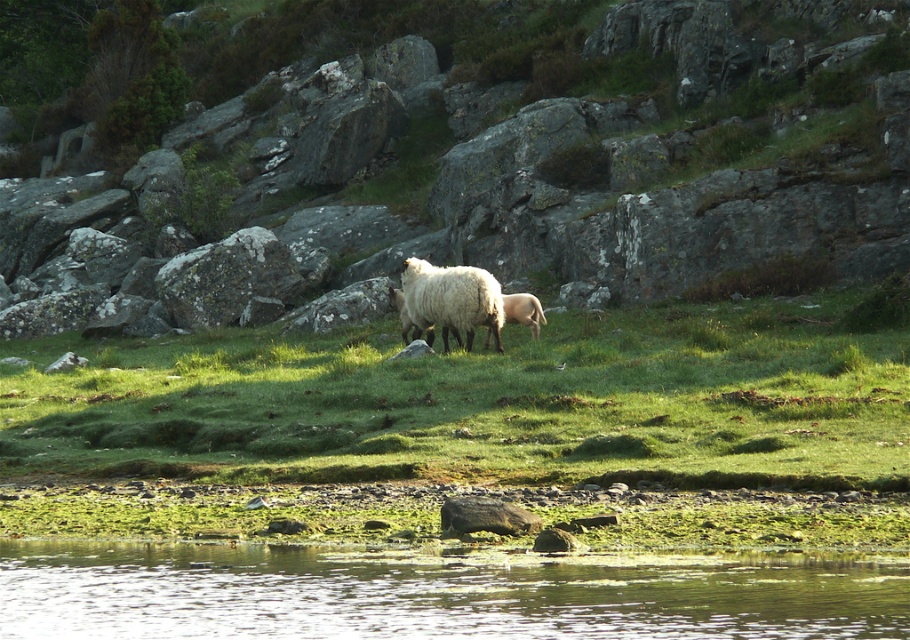
You are standing at the origin point of the image coordinate system. You want to walk to the green grassy at center. In which direction should you move? Please provide your answer in terms of the coordinate system where the x and y axes increase to the right and up respectively.

The green grassy at center is located at coordinate point 0.630 in the x direction and 0.531 in the y direction. Since the origin is at the bottom left corner of the image, you should move to the right and upwards to reach it.

You are a hiker who wants to cross the clear water at lower center to reach the white woolly sheep at center. The water is 0.5 meters deep. Can you safely cross the water? Consider the distance between them and the water depth.

The clear water at lower center and white woolly sheep at center are 19.62 meters apart. Since the water is 0.5 meters deep, it is shallow enough for a hiker to safely cross the 19.62 meters distance to reach the white woolly sheep at center.